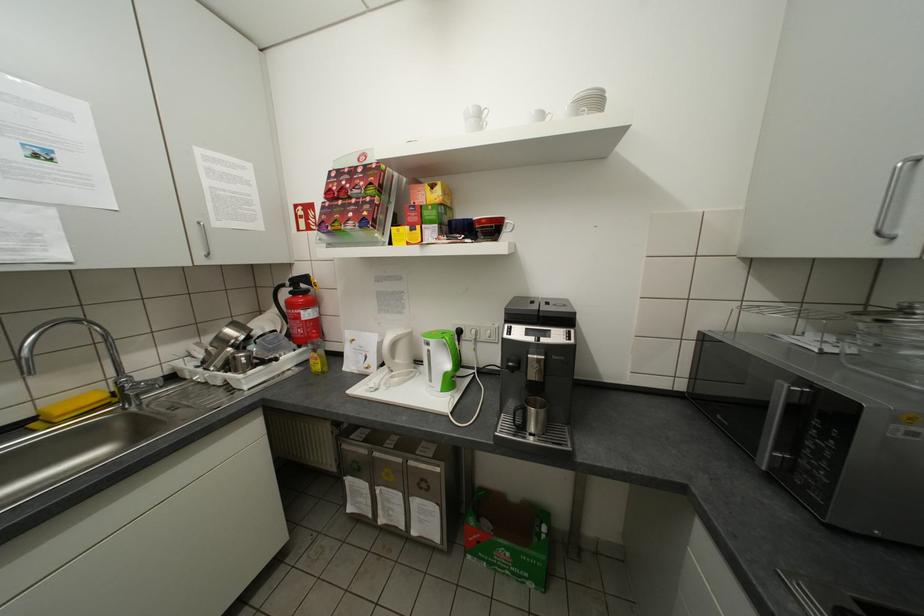
I want to click on sink faucet handle, so click(x=136, y=387).